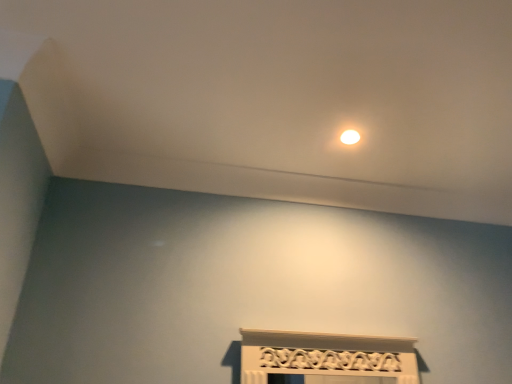
Find the location of a particular element. white glossy light fixture at upper center is located at coordinates (350, 137).

The width and height of the screenshot is (512, 384). Describe the element at coordinates (350, 137) in the screenshot. I see `white glossy light fixture at upper center` at that location.

From the picture: What is the approximate width of white glossy light fixture at upper center?

white glossy light fixture at upper center is 3.36 inches in width.

Locate an element on the screen. The width and height of the screenshot is (512, 384). white glossy light fixture at upper center is located at coordinates (350, 137).